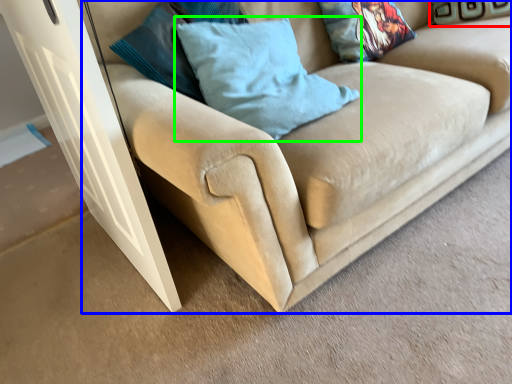
Question: Which is farther away from pillow (highlighted by a red box)? studio couch (highlighted by a blue box) or pillow (highlighted by a green box)?

Choices:
 (A) studio couch
 (B) pillow

Answer: (B)